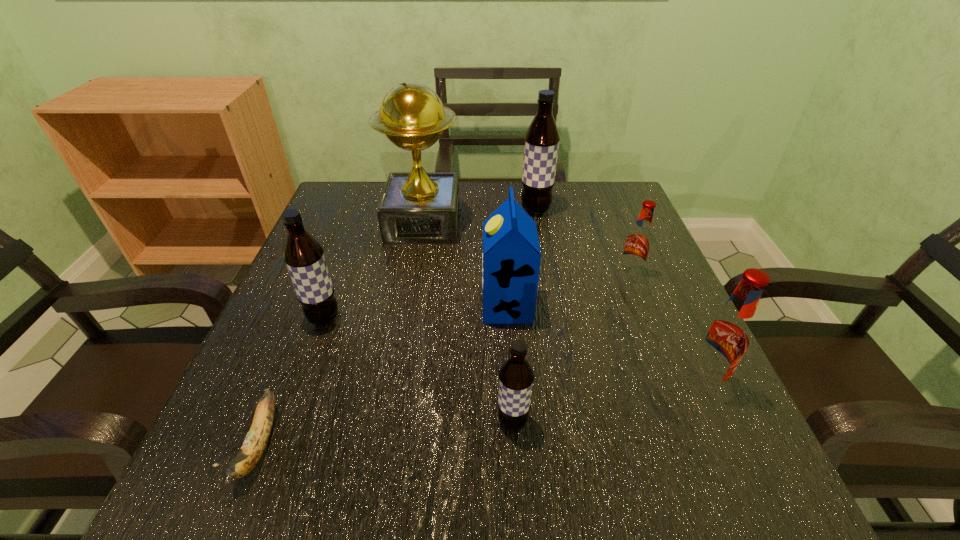
Locate an element on the screen. This screenshot has width=960, height=540. gold award is located at coordinates (418, 207).

Image resolution: width=960 pixels, height=540 pixels. I want to click on award, so click(418, 207).

Where is `the tallest root beer`? the tallest root beer is located at coordinates (542, 138).

Identify the location of the farthest root beer. Image resolution: width=960 pixels, height=540 pixels. (542, 138).

The width and height of the screenshot is (960, 540). I want to click on carton, so click(x=511, y=256).

Where is `the nearer red root beer`? This screenshot has width=960, height=540. the nearer red root beer is located at coordinates (725, 337).

Find the location of `the bigger red root beer`. the bigger red root beer is located at coordinates (725, 337).

Locate an element on the screen. the leftmost root beer is located at coordinates (303, 255).

In order to click on the second biggest brown root beer in this screenshot , I will do `click(303, 255)`.

Image resolution: width=960 pixels, height=540 pixels. I want to click on the smaller red root beer, so click(639, 240).